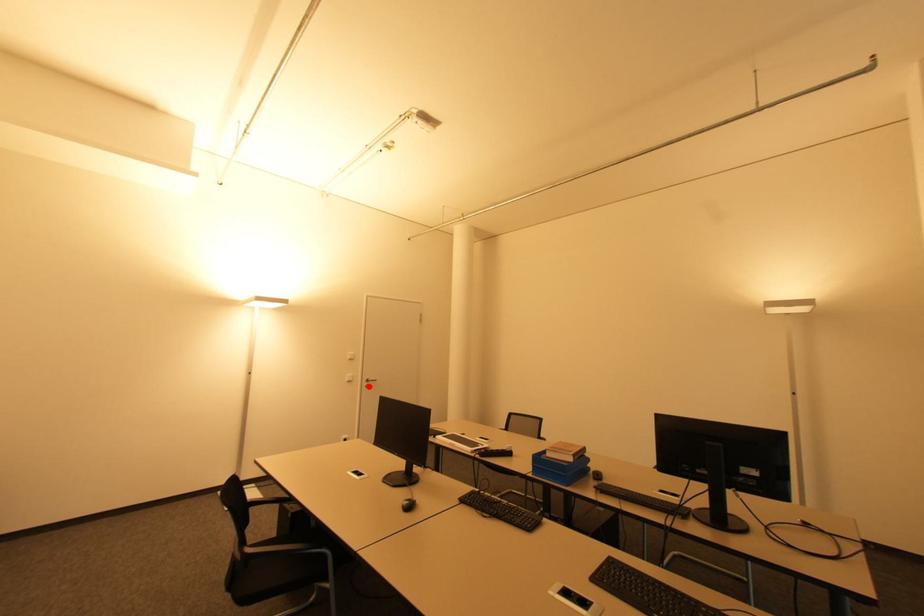
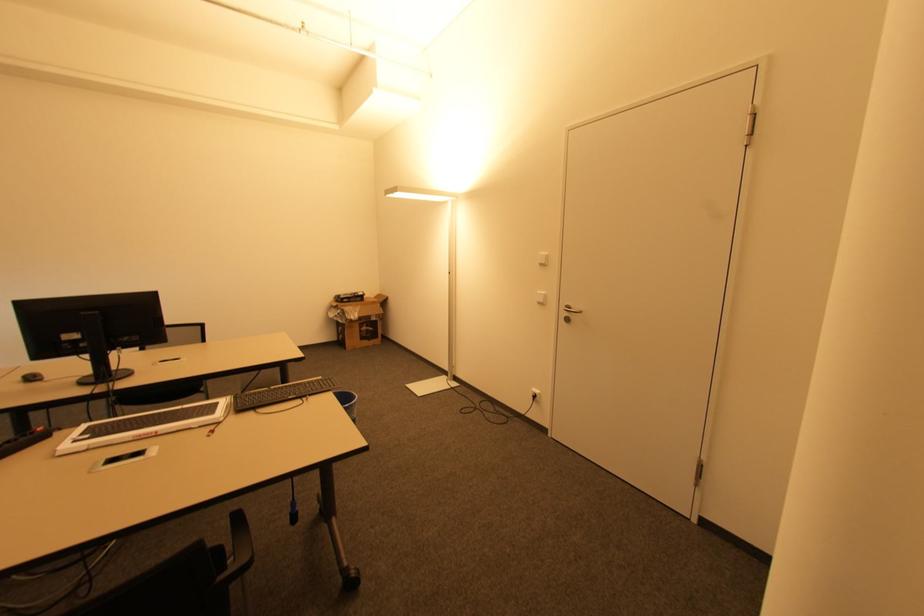
Find the pixel in the second image that matches the highlighted location in the first image.

(568, 320)